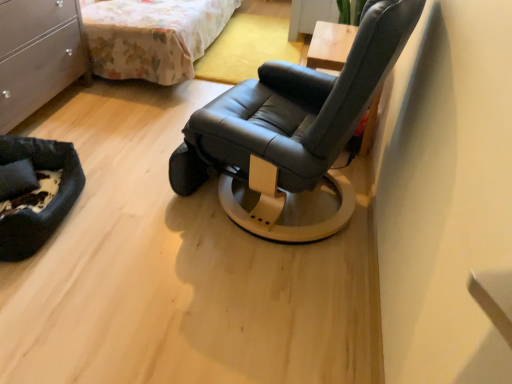
Identify the location of vacant space that's between black leather chair at center and black fabric pillow at lower left. (148, 204).